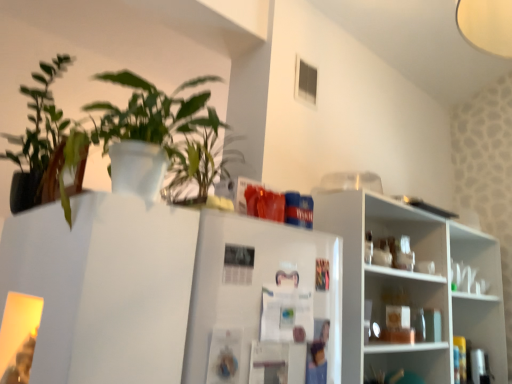
Question: Considering their positions, is white glossy shelves at right, the first shelf positioned from the top, located in front of or behind white glossy shelf at lower right, the 2th shelf viewed from the top?

Choices:
 (A) front
 (B) behind

Answer: (A)

Question: Do you think white glossy shelves at right, the second shelf in the bottom-to-top sequence, is within white glossy shelf at lower right, acting as the 1th shelf starting from the bottom, or outside of it?

Choices:
 (A) outside
 (B) inside

Answer: (A)

Question: Considering the real-world distances, which object is farthest from the white glossy shelves at right, the second shelf in the bottom-to-top sequence?

Choices:
 (A) green matte plant at upper left, marked as the 2th houseplant in a left-to-right arrangement
 (B) white glossy shelf at lower right, the 2th shelf viewed from the top
 (C) white paperboard fridge at center
 (D) green matte plant at upper left, marked as the 2th houseplant in a right-to-left arrangement

Answer: (D)

Question: Estimate the real-world distances between objects in this image. Which object is closer to the white paperboard fridge at center?

Choices:
 (A) green matte plant at upper left, the 1th houseplant when ordered from right to left
 (B) white glossy shelves at right, the first shelf positioned from the top
 (C) green matte plant at upper left, marked as the 1th houseplant in a left-to-right arrangement
 (D) white glossy shelf at lower right, acting as the 1th shelf starting from the bottom

Answer: (A)